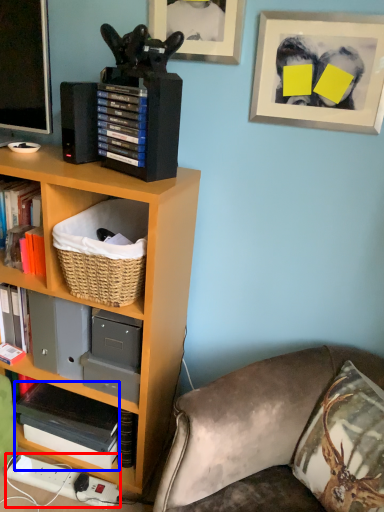
Question: Which point is closer to the camera, plug (highlighted by a red box) or paperback book (highlighted by a blue box)?

Choices:
 (A) plug
 (B) paperback book

Answer: (B)